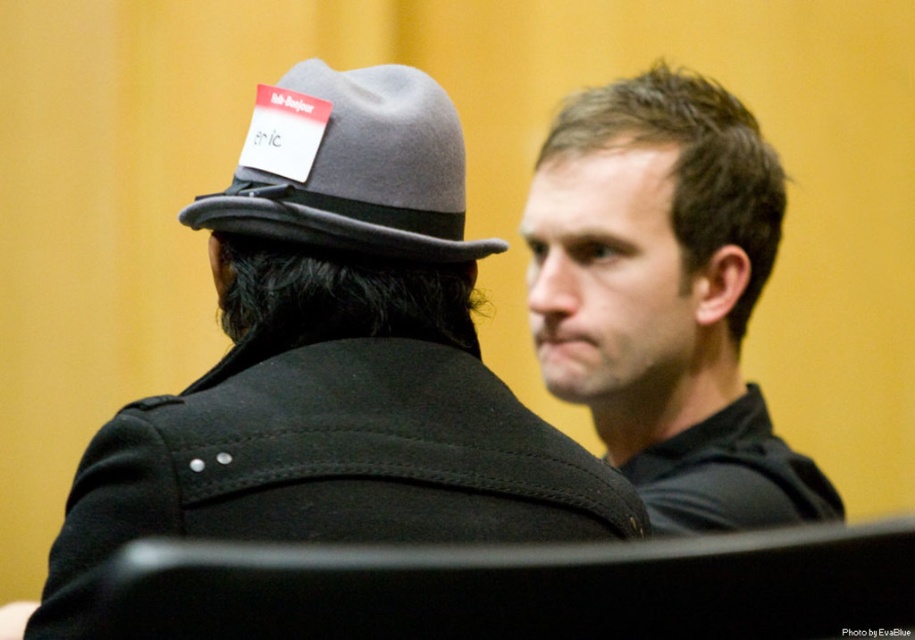
Can you confirm if matte gray hat at upper left is wider than gray felt fedora at upper left?

Indeed, matte gray hat at upper left has a greater width compared to gray felt fedora at upper left.

Who is higher up, matte gray hat at upper left or gray felt fedora at upper left?

gray felt fedora at upper left is higher up.

Does point (278, 451) lie in front of point (315, 214)?

Yes, it is.

You are a GUI agent. You are given a task and a screenshot of the screen. Output one action in this format:
    pyautogui.click(x=<x>, y=<y>)
    Task: Click on the matte gray hat at upper left
    The height and width of the screenshot is (640, 915).
    Given the screenshot: What is the action you would take?
    337,371

Which is behind, point (601, 308) or point (293, 192)?

Point (601, 308)

Is point (545, 364) closer to camera compared to point (381, 218)?

No, (545, 364) is behind (381, 218).

Which is behind, point (709, 198) or point (358, 204)?

The point (709, 198) is behind.

Where is `brown matte hair at upper right`? This screenshot has height=640, width=915. brown matte hair at upper right is located at coordinates (665, 298).

Which of these two, matte gray hat at upper left or brown matte hair at upper right, stands shorter?

matte gray hat at upper left is shorter.

Which of these two, matte gray hat at upper left or brown matte hair at upper right, stands taller?

Standing taller between the two is brown matte hair at upper right.

The width and height of the screenshot is (915, 640). I want to click on matte gray hat at upper left, so click(x=337, y=371).